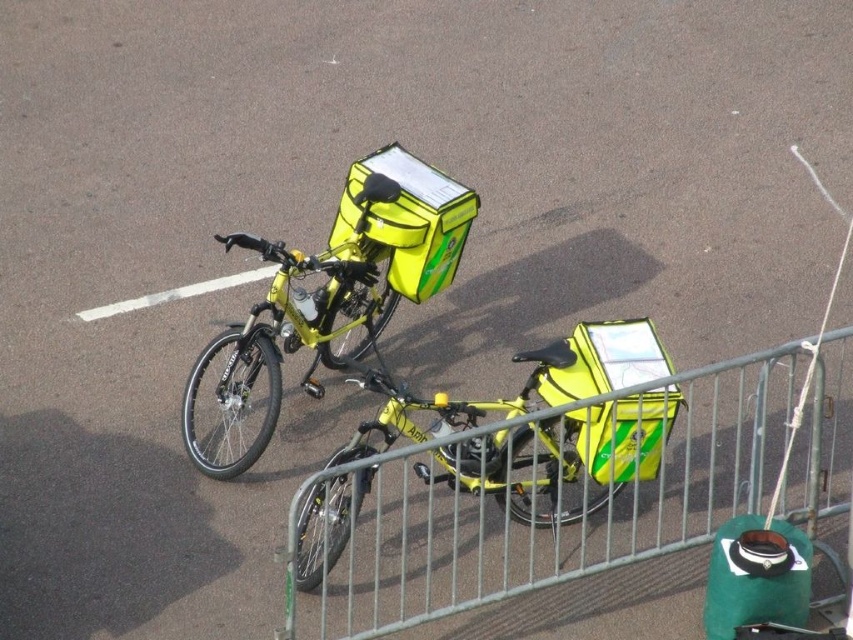
Question: Is yellow matte bicycle at center above yellow matte bicycle at upper left?

Choices:
 (A) no
 (B) yes

Answer: (A)

Question: Among these points, which one is nearest to the camera?

Choices:
 (A) (527, 355)
 (B) (335, 305)

Answer: (A)

Question: Can you confirm if yellow matte bicycle at center is positioned above yellow matte bicycle at upper left?

Choices:
 (A) yes
 (B) no

Answer: (B)

Question: Can you confirm if yellow matte bicycle at center is bigger than yellow matte bicycle at upper left?

Choices:
 (A) no
 (B) yes

Answer: (B)